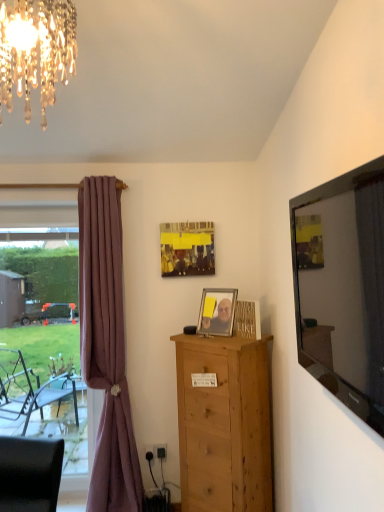
Describe the element at coordinates (217, 312) in the screenshot. I see `metallic silver picture frame at center, which is the second picture frame in top-to-bottom order` at that location.

The width and height of the screenshot is (384, 512). Find the location of `matte yellow picture frame at center, the 1th picture frame positioned from the top`. matte yellow picture frame at center, the 1th picture frame positioned from the top is located at coordinates (187, 249).

Identify the location of crystal glass chandelier at upper left. The height and width of the screenshot is (512, 384). (36, 50).

Find the location of a particular element. The image size is (384, 512). clear glass window at left is located at coordinates (43, 332).

Find the location of a particular element. mirror lying above the natural wood chest of drawers at center (from the image's perspective) is located at coordinates (342, 287).

Between flat glass mirror at right and natural wood chest of drawers at center, which one appears on the right side from the viewer's perspective?

flat glass mirror at right is more to the right.

Considering the sizes of objects flat glass mirror at right and natural wood chest of drawers at center in the image provided, who is taller, flat glass mirror at right or natural wood chest of drawers at center?

Standing taller between the two is natural wood chest of drawers at center.

Considering the relative sizes of natural wood chest of drawers at center and mauve fabric curtain at left in the image provided, is natural wood chest of drawers at center thinner than mauve fabric curtain at left?

In fact, natural wood chest of drawers at center might be wider than mauve fabric curtain at left.

Can you confirm if natural wood chest of drawers at center is shorter than mauve fabric curtain at left?

Yes, natural wood chest of drawers at center is shorter than mauve fabric curtain at left.

How much distance is there between mauve fabric curtain at left and natural wood chest of drawers at center?

They are 26.05 inches apart.

In terms of width, does mauve fabric curtain at left look wider or thinner when compared to natural wood chest of drawers at center?

Clearly, mauve fabric curtain at left has less width compared to natural wood chest of drawers at center.

Is mauve fabric curtain at left with natural wood chest of drawers at center?

mauve fabric curtain at left and natural wood chest of drawers at center are clearly separated.

Who is bigger, mauve fabric curtain at left or natural wood chest of drawers at center?

natural wood chest of drawers at center is bigger.

Is metallic silver picture frame at center, which is the second picture frame in top-to-bottom order, in front of or behind mauve fabric curtain at left in the image?

Clearly, metallic silver picture frame at center, which is the second picture frame in top-to-bottom order, is in front of mauve fabric curtain at left.

Is point (230, 313) closer to camera compared to point (92, 323)?

Yes, point (230, 313) is in front of point (92, 323).

Where is `curtain below the metallic silver picture frame at center, the 1th picture frame from the front (from the image's perspective)`? The height and width of the screenshot is (512, 384). curtain below the metallic silver picture frame at center, the 1th picture frame from the front (from the image's perspective) is located at coordinates (106, 346).

From a real-world perspective, is metallic silver picture frame at center, which is the second picture frame in top-to-bottom order, positioned above or below mauve fabric curtain at left?

metallic silver picture frame at center, which is the second picture frame in top-to-bottom order, is above mauve fabric curtain at left.

Looking at this image, does matte yellow picture frame at center, the 1th picture frame positioned from the top, have a smaller size compared to clear glass window at left?

Yes, matte yellow picture frame at center, the 1th picture frame positioned from the top, is smaller than clear glass window at left.

From a real-world perspective, which object stands above the other?

matte yellow picture frame at center, which is the 2th picture frame from front to back, is physically above.

Based on their positions, is matte yellow picture frame at center, the 1th picture frame positioned from the top, located to the left or right of clear glass window at left?

matte yellow picture frame at center, the 1th picture frame positioned from the top, is positioned on clear glass window at left's right side.

In order to click on window frame directly beneath the matte yellow picture frame at center, which is the 2th picture frame from front to back (from a real-world perspective) in this screenshot , I will do `click(43, 332)`.

Who is taller, crystal glass chandelier at upper left or clear glass window at left?

clear glass window at left.

Do you think crystal glass chandelier at upper left is within clear glass window at left, or outside of it?

Result: crystal glass chandelier at upper left cannot be found inside clear glass window at left.

Considering their positions, is crystal glass chandelier at upper left located in front of or behind clear glass window at left?

In the image, crystal glass chandelier at upper left appears in front of clear glass window at left.

Where is `chest of drawers below the metallic silver picture frame at center, which is the second picture frame in top-to-bottom order (from the image's perspective)`? The image size is (384, 512). chest of drawers below the metallic silver picture frame at center, which is the second picture frame in top-to-bottom order (from the image's perspective) is located at coordinates (224, 424).

Between natural wood chest of drawers at center and metallic silver picture frame at center, which is the second picture frame in top-to-bottom order, which one has smaller width?

With smaller width is metallic silver picture frame at center, which is the second picture frame in top-to-bottom order.

This screenshot has width=384, height=512. Find the location of `mirror in front of the natural wood chest of drawers at center`. mirror in front of the natural wood chest of drawers at center is located at coordinates (342, 287).

Locate an element on the screen. This screenshot has height=512, width=384. curtain that appears above the natural wood chest of drawers at center (from the image's perspective) is located at coordinates (106, 346).

When comparing their distances from matte yellow picture frame at center, marked as the 2th picture frame in a bottom-to-top arrangement, does metallic silver picture frame at center, acting as the first picture frame starting from the bottom, or crystal glass chandelier at upper left seem further?

crystal glass chandelier at upper left is further to matte yellow picture frame at center, marked as the 2th picture frame in a bottom-to-top arrangement.

Which object lies nearer to the anchor point matte yellow picture frame at center, which is the 2th picture frame from front to back, crystal glass chandelier at upper left or natural wood chest of drawers at center?

The object closer to matte yellow picture frame at center, which is the 2th picture frame from front to back, is natural wood chest of drawers at center.

From the picture: Looking at the image, which one is located closer to natural wood chest of drawers at center, clear glass window at left or mauve fabric curtain at left?

mauve fabric curtain at left.

From the image, which object appears to be nearer to flat glass mirror at right, mauve fabric curtain at left or clear glass window at left?

mauve fabric curtain at left is positioned closer to the anchor flat glass mirror at right.

When comparing their distances from natural wood chest of drawers at center, does matte yellow picture frame at center, marked as the 2th picture frame in a bottom-to-top arrangement, or mauve fabric curtain at left seem further?

Among the two, matte yellow picture frame at center, marked as the 2th picture frame in a bottom-to-top arrangement, is located further to natural wood chest of drawers at center.

Based on their spatial positions, is matte yellow picture frame at center, marked as the 2th picture frame in a bottom-to-top arrangement, or natural wood chest of drawers at center closer to clear glass window at left?

matte yellow picture frame at center, marked as the 2th picture frame in a bottom-to-top arrangement, is positioned closer to the anchor clear glass window at left.

From the image, which object appears to be farther from matte yellow picture frame at center, the 1th picture frame in the back-to-front sequence, flat glass mirror at right or clear glass window at left?

clear glass window at left is further to matte yellow picture frame at center, the 1th picture frame in the back-to-front sequence.

Estimate the real-world distances between objects in this image. Which object is further from flat glass mirror at right, mauve fabric curtain at left or metallic silver picture frame at center, which is the second picture frame in top-to-bottom order?

The object further to flat glass mirror at right is mauve fabric curtain at left.

Find the location of `mirror between crystal glass chandelier at upper left and mauve fabric curtain at left along the z-axis`. mirror between crystal glass chandelier at upper left and mauve fabric curtain at left along the z-axis is located at coordinates (342, 287).

Identify the location of chest of drawers between flat glass mirror at right and metallic silver picture frame at center, which is the 2th picture frame in back-to-front order, in the front-back direction. (224, 424).

The height and width of the screenshot is (512, 384). Identify the location of curtain between clear glass window at left and metallic silver picture frame at center, which is the second picture frame in top-to-bottom order, from left to right. (106, 346).

The width and height of the screenshot is (384, 512). I want to click on chest of drawers between flat glass mirror at right and mauve fabric curtain at left in the front-back direction, so click(x=224, y=424).